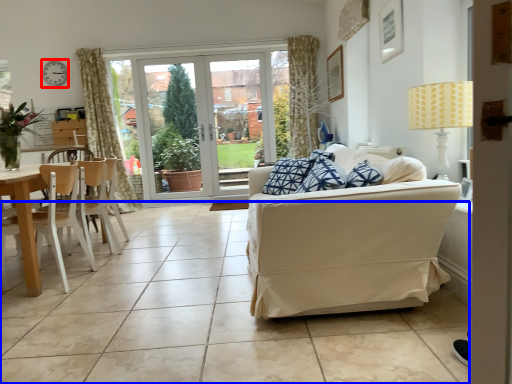
Question: Which point is closer to the camera, clock (highlighted by a red box) or ceramic tile (highlighted by a blue box)?

Choices:
 (A) clock
 (B) ceramic tile

Answer: (B)